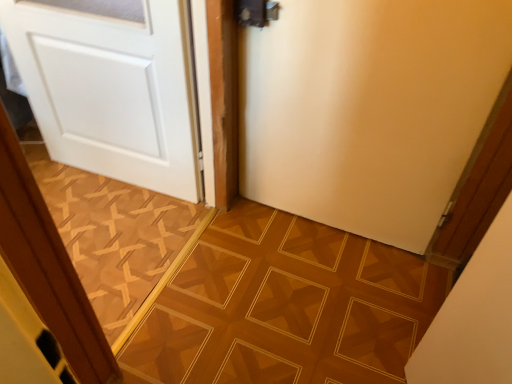
Question: From a real-world perspective, is brown textured tile at center, positioned as the 2th ceramic tile in right-to-left order, under white matte door at center, arranged as the 1th door when viewed from the right?

Choices:
 (A) no
 (B) yes

Answer: (B)

Question: Does brown textured tile at center, positioned as the 2th ceramic tile in right-to-left order, have a greater height compared to white matte door at center, arranged as the 1th door when viewed from the right?

Choices:
 (A) yes
 (B) no

Answer: (B)

Question: Is brown textured tile at center, positioned as the 2th ceramic tile in right-to-left order, aimed at white matte door at center, arranged as the 1th door when viewed from the right?

Choices:
 (A) yes
 (B) no

Answer: (B)

Question: Is brown textured tile at center, arranged as the first ceramic tile when viewed from the left, not near white matte door at center, arranged as the 1th door when viewed from the right?

Choices:
 (A) no
 (B) yes

Answer: (A)

Question: Is brown textured tile at center, arranged as the first ceramic tile when viewed from the left, at the left side of white matte door at center, arranged as the 1th door when viewed from the right?

Choices:
 (A) yes
 (B) no

Answer: (A)

Question: Based on their positions, is white matte door at center, arranged as the 1th door when viewed from the right, located to the left or right of wooden parquet floor at center, acting as the 1th ceramic tile starting from the right?

Choices:
 (A) right
 (B) left

Answer: (A)

Question: Does point (300, 89) appear closer or farther from the camera than point (378, 354)?

Choices:
 (A) farther
 (B) closer

Answer: (A)

Question: Would you say white matte door at center, arranged as the second door when viewed from the left, is inside or outside wooden parquet floor at center, acting as the 1th ceramic tile starting from the right?

Choices:
 (A) inside
 (B) outside

Answer: (B)

Question: Considering the positions of white matte door at center, arranged as the 1th door when viewed from the right, and wooden parquet floor at center, marked as the 2th ceramic tile in a left-to-right arrangement, in the image, is white matte door at center, arranged as the 1th door when viewed from the right, wider or thinner than wooden parquet floor at center, marked as the 2th ceramic tile in a left-to-right arrangement,?

Choices:
 (A) thin
 (B) wide

Answer: (A)

Question: Would you say white matte door at left, which is the 2th door in right-to-left order, is to the left or to the right of brown textured tile at center, arranged as the first ceramic tile when viewed from the left, in the picture?

Choices:
 (A) right
 (B) left

Answer: (A)

Question: Relative to brown textured tile at center, positioned as the 2th ceramic tile in right-to-left order, is white matte door at left, which is the first door in left-to-right order, in front or behind?

Choices:
 (A) behind
 (B) front

Answer: (B)

Question: In terms of size, does white matte door at left, which is the first door in left-to-right order, appear bigger or smaller than brown textured tile at center, arranged as the first ceramic tile when viewed from the left?

Choices:
 (A) small
 (B) big

Answer: (B)

Question: Is white matte door at left, which is the first door in left-to-right order, spatially inside brown textured tile at center, positioned as the 2th ceramic tile in right-to-left order, or outside of it?

Choices:
 (A) outside
 (B) inside

Answer: (A)

Question: Looking at their shapes, would you say wooden parquet floor at center, marked as the 2th ceramic tile in a left-to-right arrangement, is wider or thinner than white matte door at left, which is the first door in left-to-right order?

Choices:
 (A) thin
 (B) wide

Answer: (B)

Question: Considering their positions, is wooden parquet floor at center, acting as the 1th ceramic tile starting from the right, located in front of or behind white matte door at left, which is the 2th door in right-to-left order?

Choices:
 (A) behind
 (B) front

Answer: (B)